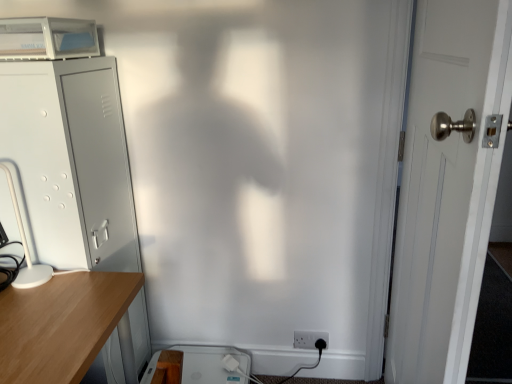
Question: From a real-world perspective, is gray metallic file cabinet at left under white plastic table lamp at left?

Choices:
 (A) yes
 (B) no

Answer: (A)

Question: Does gray metallic file cabinet at left have a greater height compared to white plastic table lamp at left?

Choices:
 (A) yes
 (B) no

Answer: (A)

Question: Is gray metallic file cabinet at left further to camera compared to white plastic table lamp at left?

Choices:
 (A) no
 (B) yes

Answer: (B)

Question: Is gray metallic file cabinet at left looking in the opposite direction of white plastic table lamp at left?

Choices:
 (A) yes
 (B) no

Answer: (B)

Question: Does gray metallic file cabinet at left turn towards white plastic table lamp at left?

Choices:
 (A) yes
 (B) no

Answer: (B)

Question: Is white plastic electric outlet at lower right in front of or behind white plastic desktop at lower center in the image?

Choices:
 (A) front
 (B) behind

Answer: (B)

Question: Based on their positions, is white plastic electric outlet at lower right located to the left or right of white plastic desktop at lower center?

Choices:
 (A) right
 (B) left

Answer: (A)

Question: Does point (326, 345) appear closer or farther from the camera than point (192, 357)?

Choices:
 (A) farther
 (B) closer

Answer: (A)

Question: From a real-world perspective, relative to white plastic desktop at lower center, is white plastic electric outlet at lower right vertically above or below?

Choices:
 (A) above
 (B) below

Answer: (A)

Question: Is gray metallic file cabinet at left bigger or smaller than white plastic table lamp at left?

Choices:
 (A) small
 (B) big

Answer: (B)

Question: Which is correct: gray metallic file cabinet at left is inside white plastic table lamp at left, or outside of it?

Choices:
 (A) inside
 (B) outside

Answer: (B)

Question: In terms of height, does gray metallic file cabinet at left look taller or shorter compared to white plastic table lamp at left?

Choices:
 (A) tall
 (B) short

Answer: (A)

Question: From the image's perspective, is gray metallic file cabinet at left above or below white plastic table lamp at left?

Choices:
 (A) above
 (B) below

Answer: (B)

Question: Which is correct: gray metallic file cabinet at left is inside white plastic desktop at lower center, or outside of it?

Choices:
 (A) outside
 (B) inside

Answer: (A)

Question: Considering the positions of gray metallic file cabinet at left and white plastic desktop at lower center in the image, is gray metallic file cabinet at left taller or shorter than white plastic desktop at lower center?

Choices:
 (A) tall
 (B) short

Answer: (A)